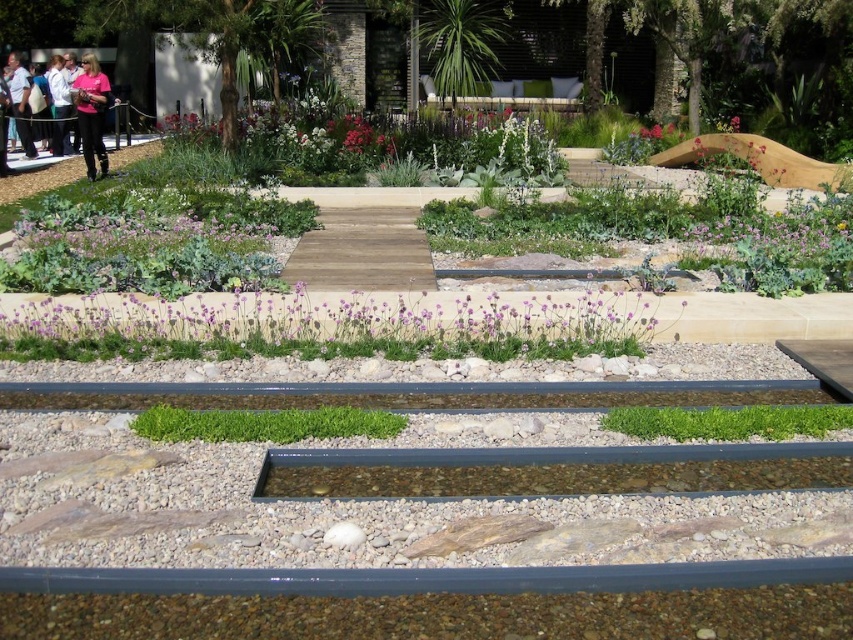
Question: Considering the real-world distances, which object is farthest from the green grass at center?

Choices:
 (A) white cotton shirt at left
 (B) brown wooden path at center

Answer: (A)

Question: Does green leafy plant at center have a larger size compared to pink fabric at upper left?

Choices:
 (A) yes
 (B) no

Answer: (B)

Question: Which of these objects is positioned farthest from the purple matte flower at upper center?

Choices:
 (A) pink fabric at upper left
 (B) brown wooden path at center
 (C) white cotton shirt at left

Answer: (A)

Question: Can you confirm if green grass at center is bigger than pink fabric at left?

Choices:
 (A) yes
 (B) no

Answer: (B)

Question: Which of these objects is positioned farthest from the purple grass at center?

Choices:
 (A) white cotton shirt at left
 (B) green grass at center
 (C) pink fabric at upper left

Answer: (A)

Question: Is purple grass at center thinner than green grass at center?

Choices:
 (A) yes
 (B) no

Answer: (B)